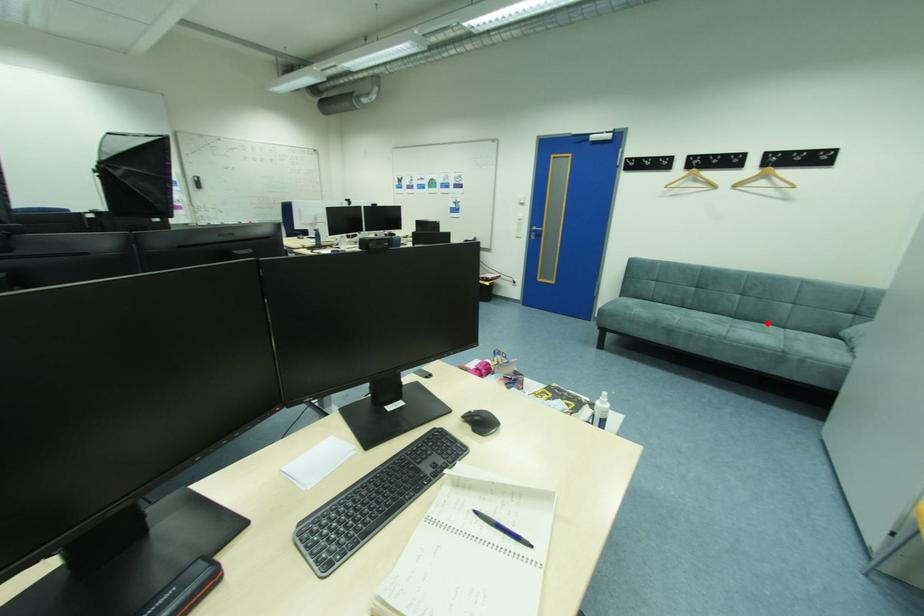
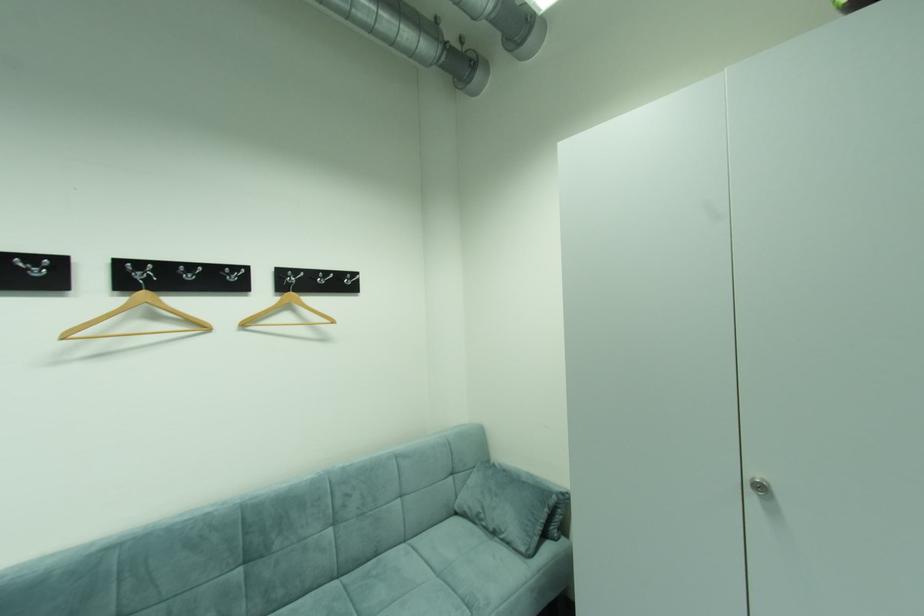
In the second image, find the point that corresponds to the highlighted location in the first image.

(383, 554)